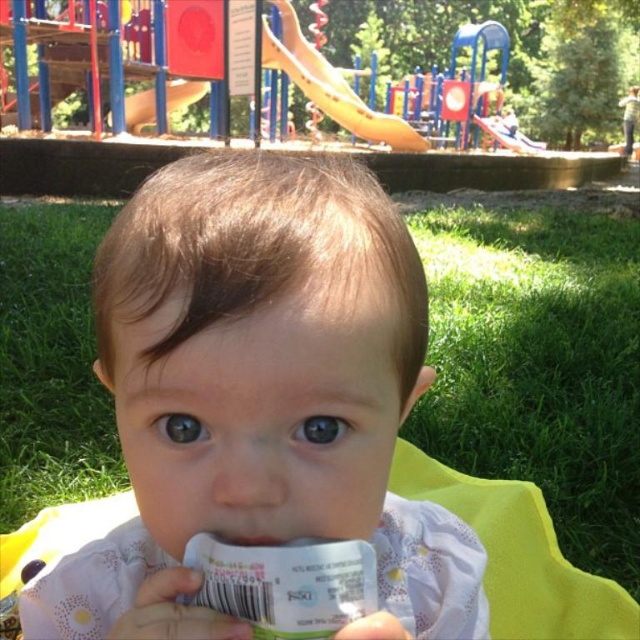
Question: Which object is the closest to the light pink fabric at center?

Choices:
 (A) yellow plastic slide at upper center
 (B) white matte pacifier at center

Answer: (B)

Question: Does light pink fabric at center have a greater width compared to white matte pacifier at center?

Choices:
 (A) no
 (B) yes

Answer: (B)

Question: Does yellow plastic slide at upper center have a greater width compared to white matte pacifier at center?

Choices:
 (A) no
 (B) yes

Answer: (B)

Question: Among these points, which one is nearest to the camera?

Choices:
 (A) (339, 90)
 (B) (212, 160)
 (C) (260, 538)

Answer: (C)

Question: Which object is positioned farthest from the yellow plastic slide at upper center?

Choices:
 (A) white matte pacifier at center
 (B) light pink fabric at center

Answer: (A)

Question: Is light pink fabric at center to the right of white matte pacifier at center from the viewer's perspective?

Choices:
 (A) yes
 (B) no

Answer: (B)